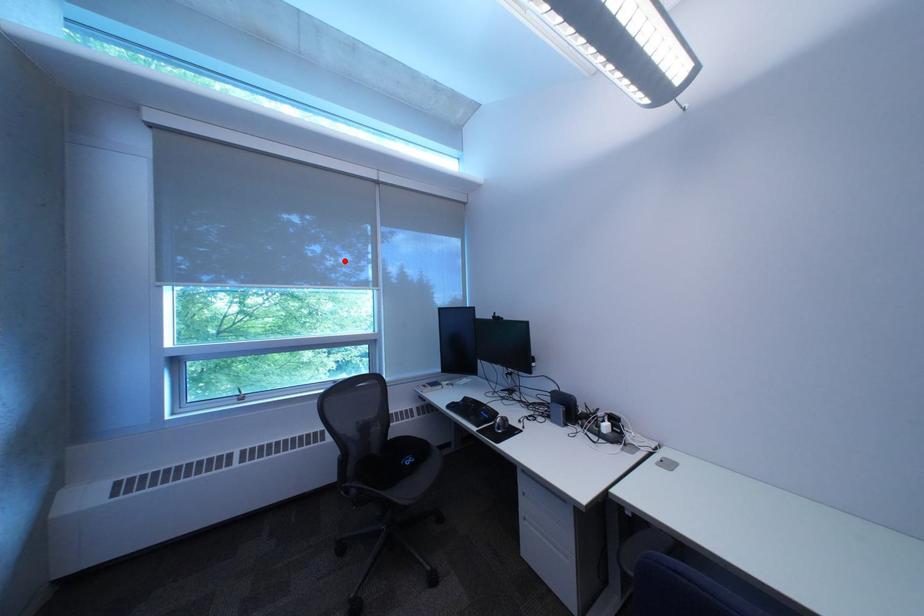
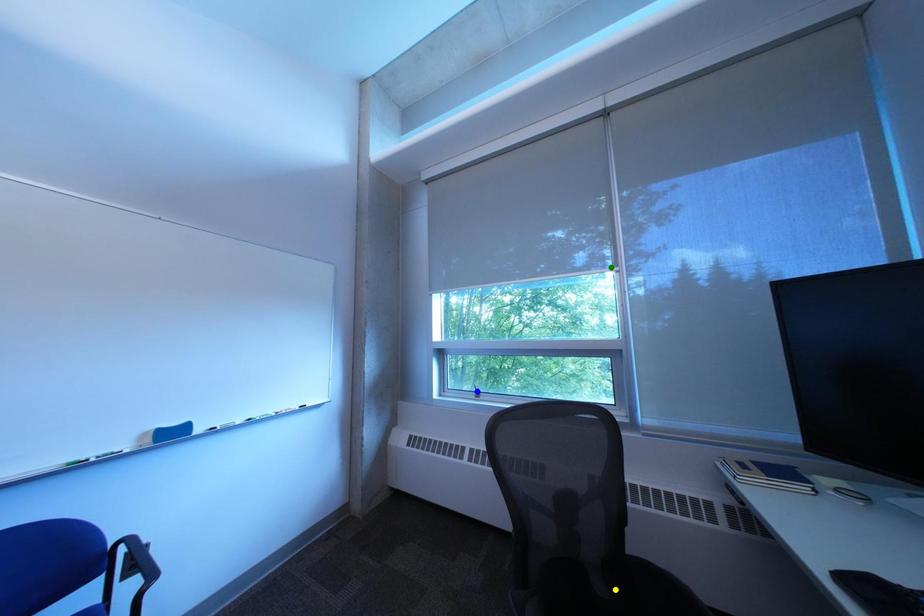
Question: I am providing you with two images of the same scene from different viewpoints. A red point is marked on the first image. You are given multiple points on the second image. Which point in image 2 is actually the same real-world point as the red point in image 1?

Choices:
 (A) blue point
 (B) yellow point
 (C) green point

Answer: (C)